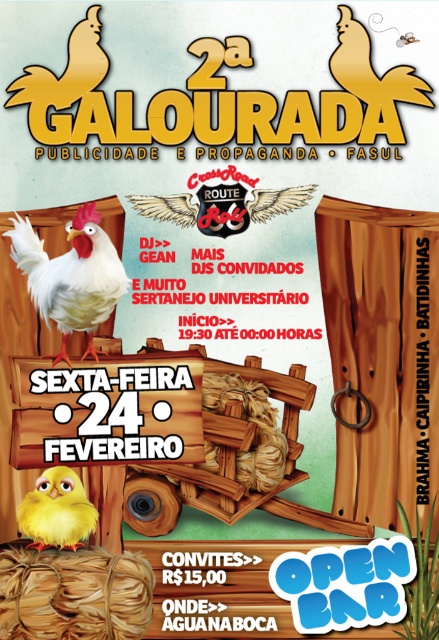
Question: Does white matte chicken at center appear on the right side of yellow matte chick at lower left?

Choices:
 (A) yes
 (B) no

Answer: (A)

Question: Considering the relative positions of white matte chicken at center and yellow matte chick at lower left in the image provided, where is white matte chicken at center located with respect to yellow matte chick at lower left?

Choices:
 (A) above
 (B) below

Answer: (A)

Question: Which of the following is the closest to the observer?

Choices:
 (A) yellow matte chick at lower left
 (B) white matte chicken at center

Answer: (A)

Question: Can you confirm if white matte chicken at center is positioned to the left of yellow matte chick at lower left?

Choices:
 (A) yes
 (B) no

Answer: (B)